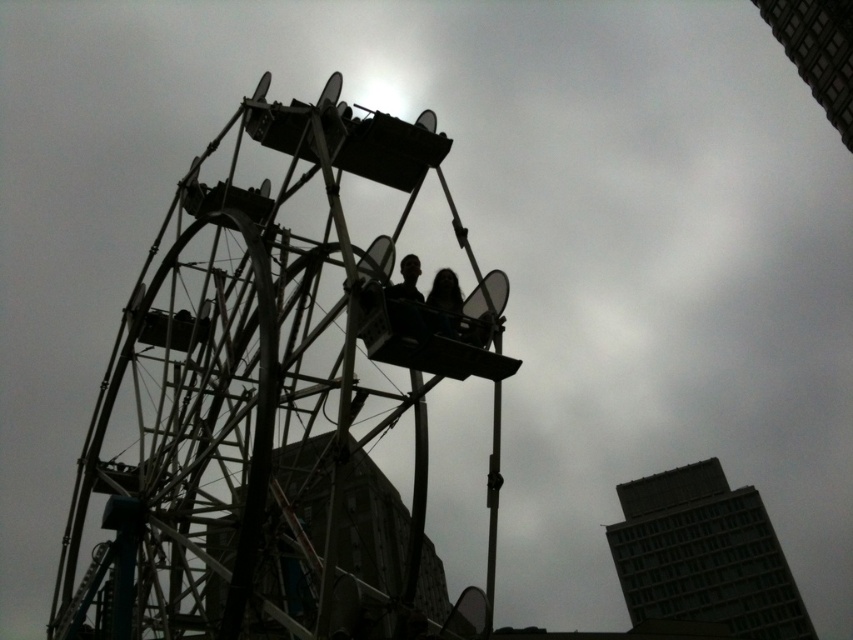
Does gray concrete building at center have a smaller size compared to silhouette fabric at center?

No.

Is point (624, 486) positioned after point (395, 296)?

Yes, point (624, 486) is farther from viewer.

Who is more distant from viewer, (x=749, y=625) or (x=413, y=282)?

Point (x=749, y=625)

Where is `gray concrete building at center`? gray concrete building at center is located at coordinates (703, 556).

Between silhouette fabric at center and dark hair at center, which one is positioned lower?

dark hair at center

Can you confirm if silhouette fabric at center is smaller than dark hair at center?

No.

Between point (415, 259) and point (445, 275), which one is positioned behind?

The point (445, 275) is behind.

Locate an element on the screen. This screenshot has width=853, height=640. silhouette fabric at center is located at coordinates (407, 300).

Is gray concrete building at center taller than dark hair at center?

Correct, gray concrete building at center is much taller as dark hair at center.

Where is `gray concrete building at center`? This screenshot has width=853, height=640. gray concrete building at center is located at coordinates (703, 556).

You are a GUI agent. You are given a task and a screenshot of the screen. Output one action in this format:
    pyautogui.click(x=<x>, y=<y>)
    Task: Click on the gray concrete building at center
    Image resolution: width=853 pixels, height=640 pixels.
    Given the screenshot: What is the action you would take?
    pyautogui.click(x=703, y=556)